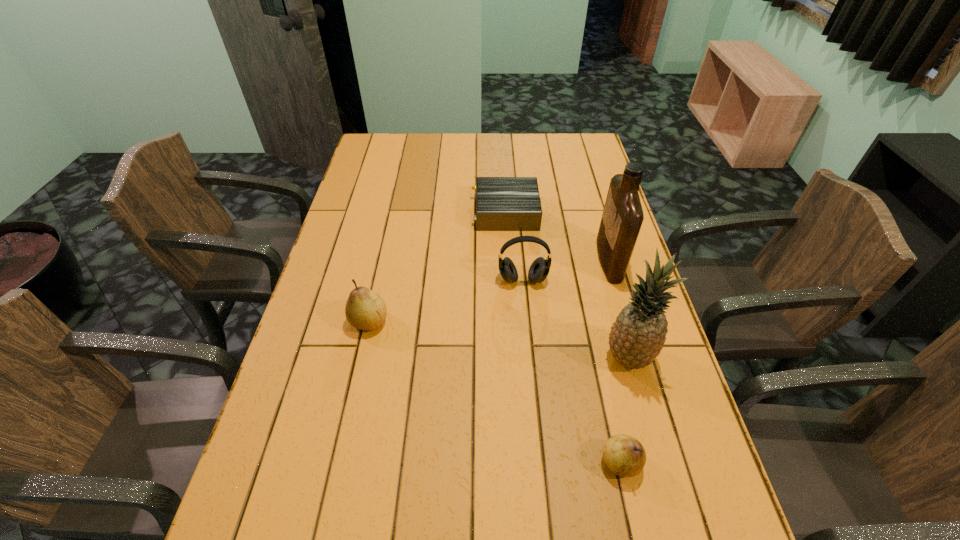
I want to click on spot to insert another pear for uniform distribution, so click(479, 383).